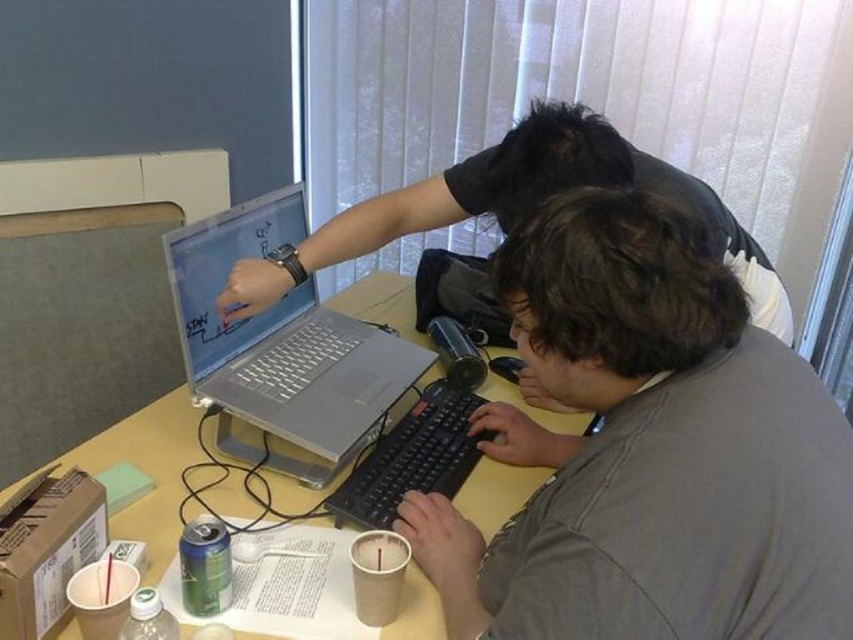
You are a photographer trying to capture a closeup of the keyboard in the scene. You notice two points marked as point 1 at coordinates (x=343, y=435) and point 2 at coordinates (x=221, y=212). Which point should you focus on to ensure the keyboard is in sharp focus?

Point 1 at coordinates (x=343, y=435) should be focused on because it is closer to the camera than point 2 at coordinates (x=221, y=212), ensuring the keyboard will be in sharp focus.